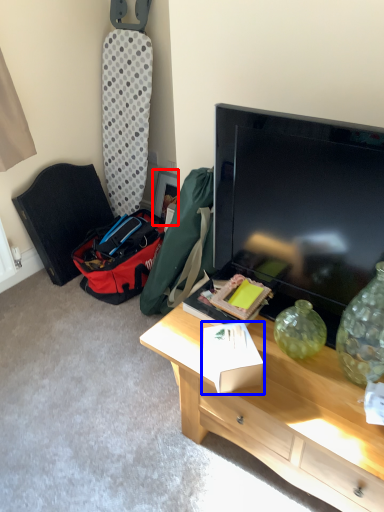
Question: Among these objects, which one is nearest to the camera, picture frame (highlighted by a red box) or box (highlighted by a blue box)?

Choices:
 (A) picture frame
 (B) box

Answer: (B)